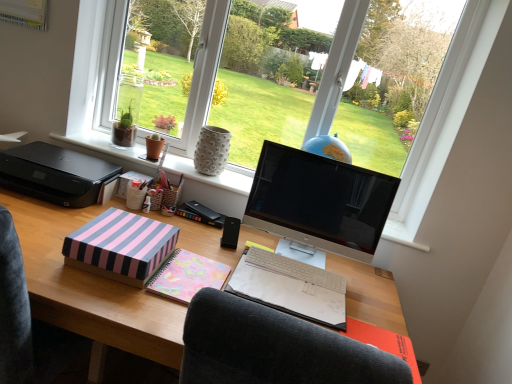
You are a GUI agent. You are given a task and a screenshot of the screen. Output one action in this format:
    pyautogui.click(x=<x>, y=<y>)
    Task: Click on the empty space that is to the right of pastel floral notebook at center
    
    Given the screenshot: What is the action you would take?
    (371, 294)